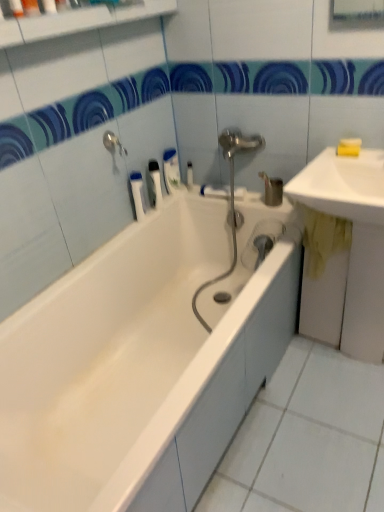
At what (x,y) coordinates should I click in order to perform the action: click on empty space that is ontop of white glossy sink at upper right, arranged as the 2th sink when ordered from the bottom. Please return your answer as a coordinate pair (x, y). Image resolution: width=384 pixels, height=512 pixels. Looking at the image, I should click on (342, 169).